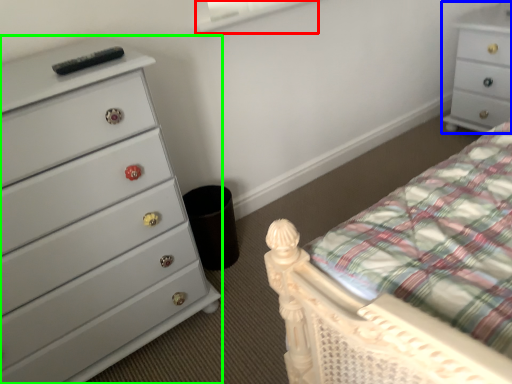
Question: Which object is the farthest from window screen (highlighted by a red box)? Choose among these: chest of drawers (highlighted by a blue box) or chest of drawers (highlighted by a green box).

Choices:
 (A) chest of drawers
 (B) chest of drawers

Answer: (A)